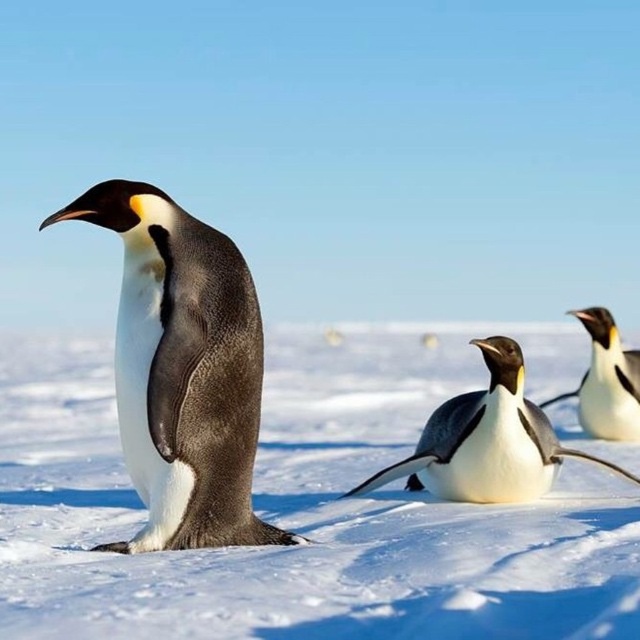
Consider the image. You are an animal researcher observing the emperor penguins in the winter scene. You have a measuring tape that can extend up to 3 meters. If you want to measure the distance between the white fluffy snow at center and the white glossy penguin at center, will your measuring tape be long enough?

The distance between the white fluffy snow at center and the white glossy penguin at center is 2.91 meters, which is within the 3 meter limit of the measuring tape. Therefore, the measuring tape is long enough to measure the distance between the white fluffy snow at center and the white glossy penguin at center.

You are a photographer standing in front of the emperor penguins. You want to take a photo that includes both point A at point [436,506] and point B at point [236,262]. Which point is closer to your camera?

Point B at point [236,262] is closer to the camera than point A at point [436,506].